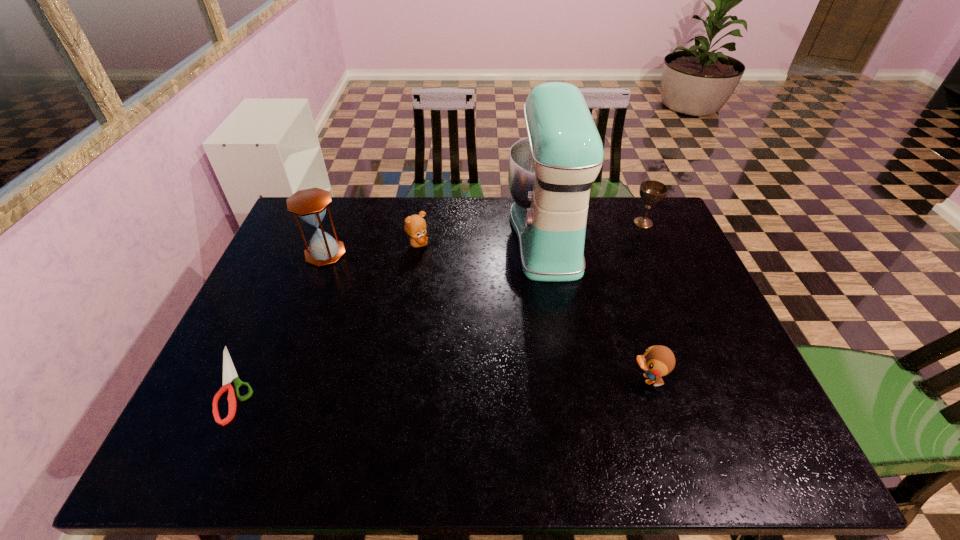
In the image, there is a desktop. What are the coordinates of `free region at the right edge` in the screenshot? It's located at (708, 364).

In the image, there is a desktop. Where is `vacant space at the far left corner`? Image resolution: width=960 pixels, height=540 pixels. vacant space at the far left corner is located at coordinates coord(313,227).

You are a GUI agent. You are given a task and a screenshot of the screen. Output one action in this format:
    pyautogui.click(x=<x>, y=<y>)
    Task: Click on the free space at the far right corner of the desktop
    The image size is (960, 540).
    Given the screenshot: What is the action you would take?
    pyautogui.click(x=677, y=237)

The height and width of the screenshot is (540, 960). What are the coordinates of `vacant area that lies between the second object from right to left and the tallest object` in the screenshot? It's located at (597, 307).

You are a GUI agent. You are given a task and a screenshot of the screen. Output one action in this format:
    pyautogui.click(x=<x>, y=<y>)
    Task: Click on the free space between the scissors and the fifth shortest object
    The image size is (960, 540).
    Given the screenshot: What is the action you would take?
    pyautogui.click(x=279, y=318)

Identify the location of vacant area that lies between the fifth object from left to right and the fourth shortest object. The width and height of the screenshot is (960, 540). (645, 301).

Identify the location of free space between the duck and the third tallest object. Image resolution: width=960 pixels, height=540 pixels. (645, 301).

Find the location of a particular element. The width and height of the screenshot is (960, 540). free spot between the tallest object and the teddy bear is located at coordinates (482, 240).

Locate an element on the screen. The image size is (960, 540). free space that is in between the third object from right to left and the shortest object is located at coordinates (390, 309).

The image size is (960, 540). Find the location of `unoccupied position between the mixer and the scissors`. unoccupied position between the mixer and the scissors is located at coordinates (390, 309).